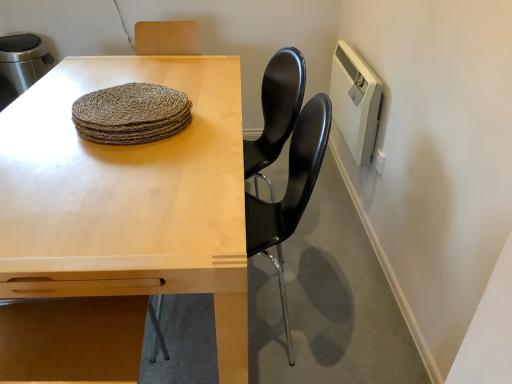
Question: Can you confirm if natural woven placemat at center is wider than white plastic radiator at upper right?

Choices:
 (A) no
 (B) yes

Answer: (B)

Question: Is natural woven placemat at center shorter than white plastic radiator at upper right?

Choices:
 (A) yes
 (B) no

Answer: (A)

Question: Is natural woven placemat at center oriented away from white plastic radiator at upper right?

Choices:
 (A) no
 (B) yes

Answer: (A)

Question: Does natural woven placemat at center contain white plastic radiator at upper right?

Choices:
 (A) yes
 (B) no

Answer: (B)

Question: From the image's perspective, is natural woven placemat at center on white plastic radiator at upper right?

Choices:
 (A) no
 (B) yes

Answer: (A)

Question: Is natural woven placemat at center bigger than white plastic radiator at upper right?

Choices:
 (A) no
 (B) yes

Answer: (A)

Question: Does natural woven placemat at center appear on the right side of light wood table at center?

Choices:
 (A) no
 (B) yes

Answer: (B)

Question: Is natural woven placemat at center next to light wood table at center?

Choices:
 (A) no
 (B) yes

Answer: (A)

Question: Is natural woven placemat at center turned away from light wood table at center?

Choices:
 (A) no
 (B) yes

Answer: (A)

Question: Can you confirm if natural woven placemat at center is taller than light wood table at center?

Choices:
 (A) yes
 (B) no

Answer: (B)

Question: Can you confirm if natural woven placemat at center is shorter than light wood table at center?

Choices:
 (A) no
 (B) yes

Answer: (B)

Question: Does natural woven placemat at center turn towards light wood table at center?

Choices:
 (A) yes
 (B) no

Answer: (B)

Question: Can you confirm if black glossy chair at center is positioned to the right of natural woven placemat at center?

Choices:
 (A) yes
 (B) no

Answer: (A)